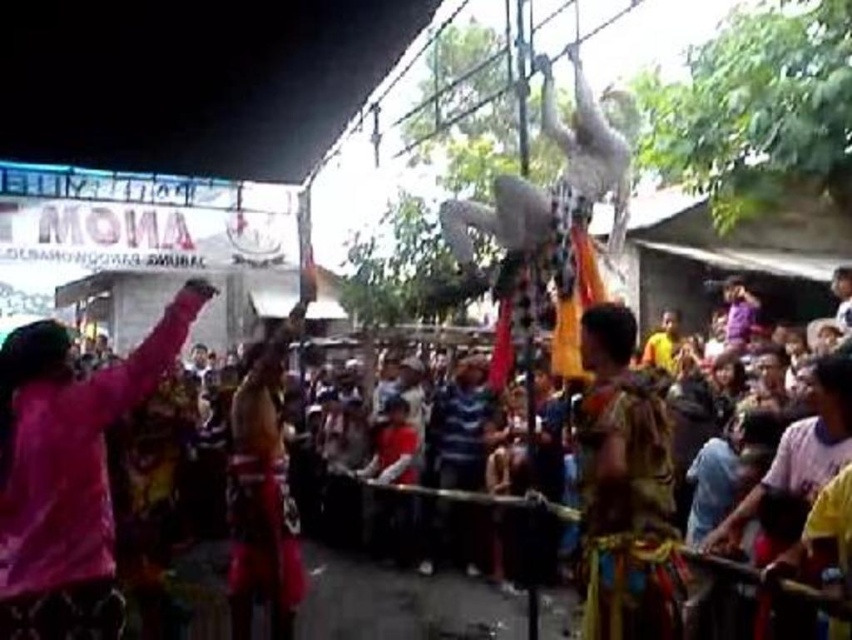
Question: Among these points, which one is nearest to the camera?

Choices:
 (A) (632, 374)
 (B) (104, 566)

Answer: (B)

Question: Which point is farther to the camera?

Choices:
 (A) (44, 433)
 (B) (237, 420)

Answer: (B)

Question: Which of the following is the farthest from the observer?

Choices:
 (A) (609, 461)
 (B) (283, 627)

Answer: (B)

Question: Does multicolored fabric at center have a larger size compared to multicolored fabric crowd at center?

Choices:
 (A) yes
 (B) no

Answer: (A)

Question: Is multicolored fabric at center below multicolored fabric crowd at center?

Choices:
 (A) yes
 (B) no

Answer: (A)

Question: Is purple fabric at left positioned behind reddish-brown fabric costume at center?

Choices:
 (A) yes
 (B) no

Answer: (B)